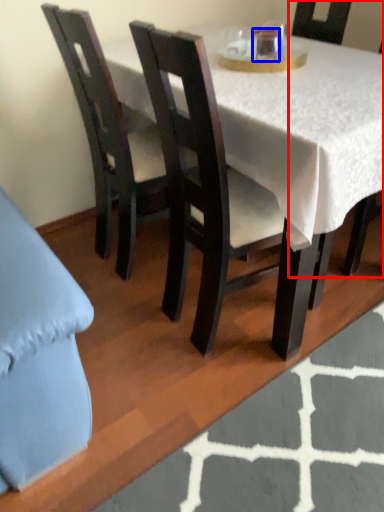
Question: Which object is closer to the camera taking this photo, chair (highlighted by a red box) or coffee cup (highlighted by a blue box)?

Choices:
 (A) chair
 (B) coffee cup

Answer: (A)